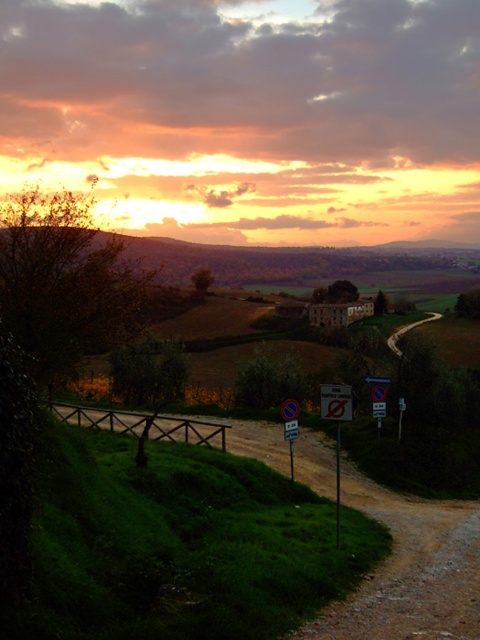
Looking at this image, you are standing at the camera position looking at the scene. Which of the two points, point [360,632] or point [322,413], is nearer to you?

Point [360,632] is closer to the camera than point [322,413], so it is nearer to you.